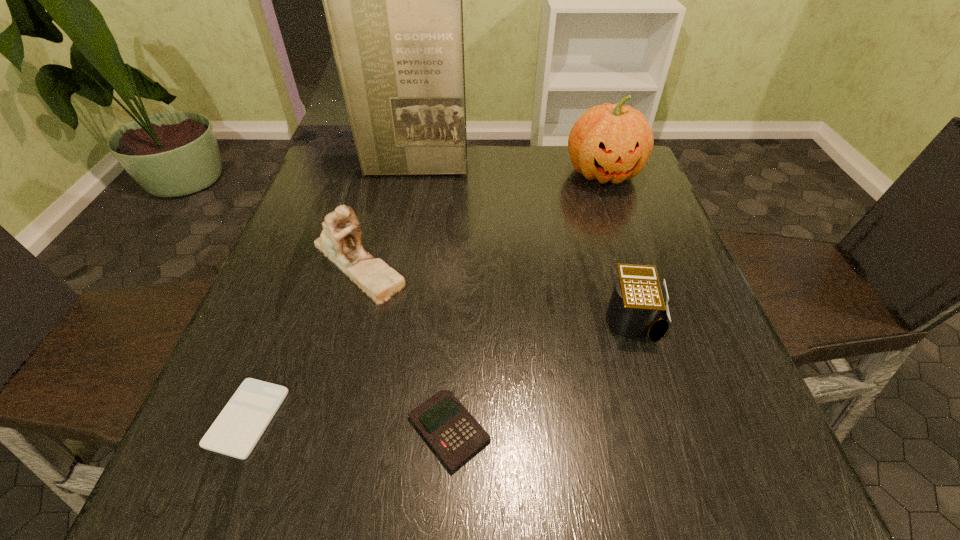
Locate an element on the screen. The width and height of the screenshot is (960, 540). phonebook is located at coordinates (393, 3).

The height and width of the screenshot is (540, 960). I want to click on the second tallest object, so click(608, 142).

The image size is (960, 540). In order to click on figurine in this screenshot , I will do `click(340, 241)`.

The image size is (960, 540). What are the coordinates of `the farthest calculator` in the screenshot? It's located at (638, 306).

At what (x,y) coordinates should I click in order to perform the action: click on the fourth tallest object. Please return your answer as a coordinate pair (x, y). This screenshot has height=540, width=960. Looking at the image, I should click on (638, 306).

Find the location of a particular element. The image size is (960, 540). the second calculator from right to left is located at coordinates (455, 435).

Find the location of a particular element. The image size is (960, 540). the second shortest object is located at coordinates (455, 435).

At what (x,y) coordinates should I click in order to perform the action: click on the leftmost calculator. Please return your answer as a coordinate pair (x, y). This screenshot has width=960, height=540. Looking at the image, I should click on (235, 432).

Locate an element on the screen. the shortest object is located at coordinates (235, 432).

Locate an element on the screen. free space located on the cover of the phonebook is located at coordinates (400, 238).